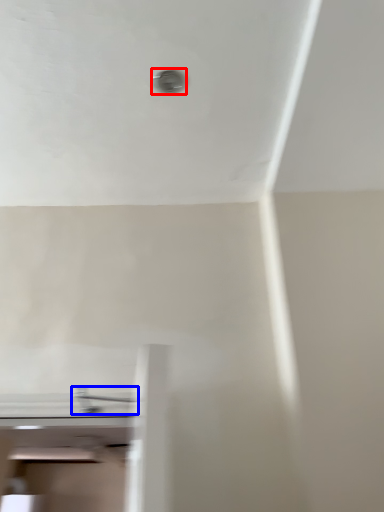
Question: Which object appears farthest to the camera in this image, hole (highlighted by a red box) or tap (highlighted by a blue box)?

Choices:
 (A) hole
 (B) tap

Answer: (A)